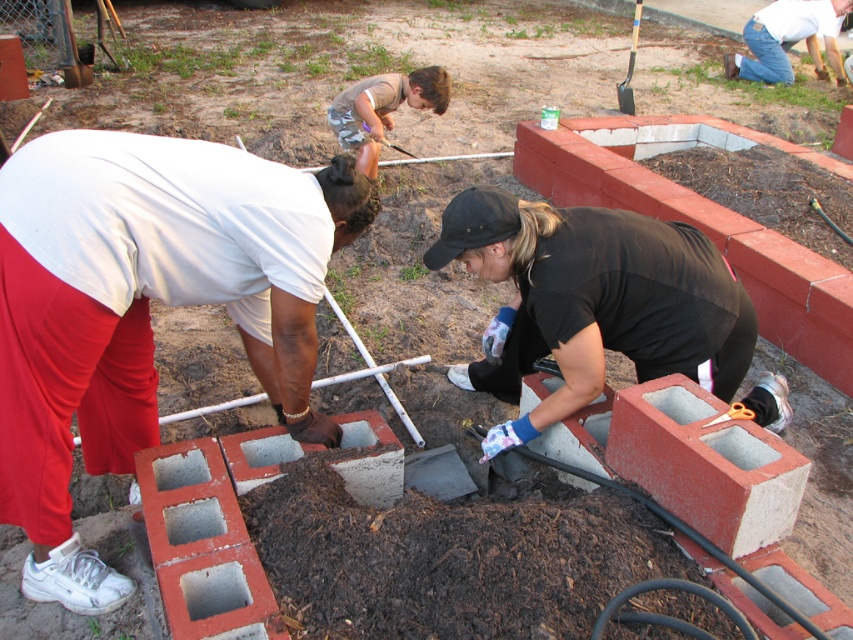
Which of these two, jeans at upper right or orange plastic scissors at lower right, stands shorter?

orange plastic scissors at lower right is shorter.

Locate an element on the screen. The image size is (853, 640). jeans at upper right is located at coordinates (788, 38).

Which is more to the right, black matte gloves at lower center or orange plastic scissors at lower right?

orange plastic scissors at lower right is more to the right.

Is black matte gloves at lower center thinner than orange plastic scissors at lower right?

In fact, black matte gloves at lower center might be wider than orange plastic scissors at lower right.

Image resolution: width=853 pixels, height=640 pixels. What are the coordinates of `black matte gloves at lower center` in the screenshot? It's located at (592, 301).

Which is below, jeans at upper right or wooden handle shovel at upper right?

jeans at upper right is lower down.

Does point (817, 20) come in front of point (624, 83)?

No.

Between point (796, 17) and point (631, 92), which one is positioned behind?

The point (796, 17) is more distant.

The height and width of the screenshot is (640, 853). I want to click on jeans at upper right, so tap(788, 38).